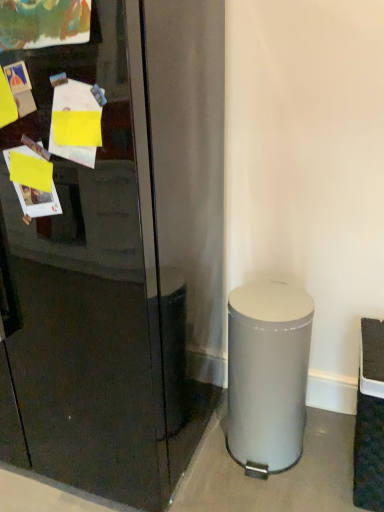
Question: From a real-world perspective, is silver metallic trash can at lower right over glossy black refrigerator at center?

Choices:
 (A) yes
 (B) no

Answer: (B)

Question: Considering the relative positions of silver metallic trash can at lower right and glossy black refrigerator at center in the image provided, is silver metallic trash can at lower right to the right of glossy black refrigerator at center from the viewer's perspective?

Choices:
 (A) no
 (B) yes

Answer: (B)

Question: Is the depth of silver metallic trash can at lower right less than that of glossy black refrigerator at center?

Choices:
 (A) no
 (B) yes

Answer: (A)

Question: Does silver metallic trash can at lower right have a larger size compared to glossy black refrigerator at center?

Choices:
 (A) no
 (B) yes

Answer: (A)

Question: From the image's perspective, is silver metallic trash can at lower right below glossy black refrigerator at center?

Choices:
 (A) no
 (B) yes

Answer: (B)

Question: Is silver metallic trash can at lower right outside glossy black refrigerator at center?

Choices:
 (A) no
 (B) yes

Answer: (B)

Question: Is glossy black refrigerator at center aimed at silver metallic trash can at lower right?

Choices:
 (A) no
 (B) yes

Answer: (A)

Question: Is glossy black refrigerator at center facing away from silver metallic trash can at lower right?

Choices:
 (A) yes
 (B) no

Answer: (B)

Question: Is glossy black refrigerator at center further to camera compared to silver metallic trash can at lower right?

Choices:
 (A) no
 (B) yes

Answer: (A)

Question: Can you confirm if glossy black refrigerator at center is positioned to the left of silver metallic trash can at lower right?

Choices:
 (A) yes
 (B) no

Answer: (A)

Question: Considering the relative sizes of glossy black refrigerator at center and silver metallic trash can at lower right in the image provided, is glossy black refrigerator at center taller than silver metallic trash can at lower right?

Choices:
 (A) yes
 (B) no

Answer: (A)

Question: Can you confirm if glossy black refrigerator at center is shorter than silver metallic trash can at lower right?

Choices:
 (A) no
 (B) yes

Answer: (A)

Question: Based on their positions, is silver metallic trash can at lower right located to the left or right of glossy black refrigerator at center?

Choices:
 (A) left
 (B) right

Answer: (B)